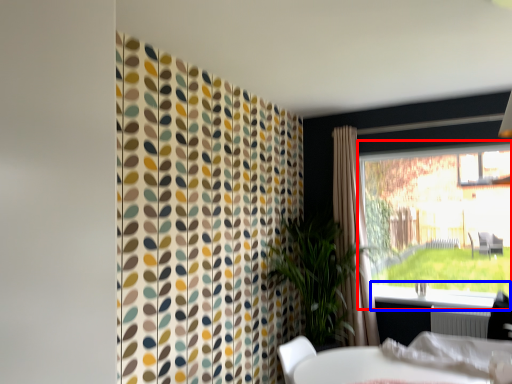
Question: Which object appears closest to the camera in this image, window (highlighted by a red box) or window sill (highlighted by a blue box)?

Choices:
 (A) window
 (B) window sill

Answer: (B)